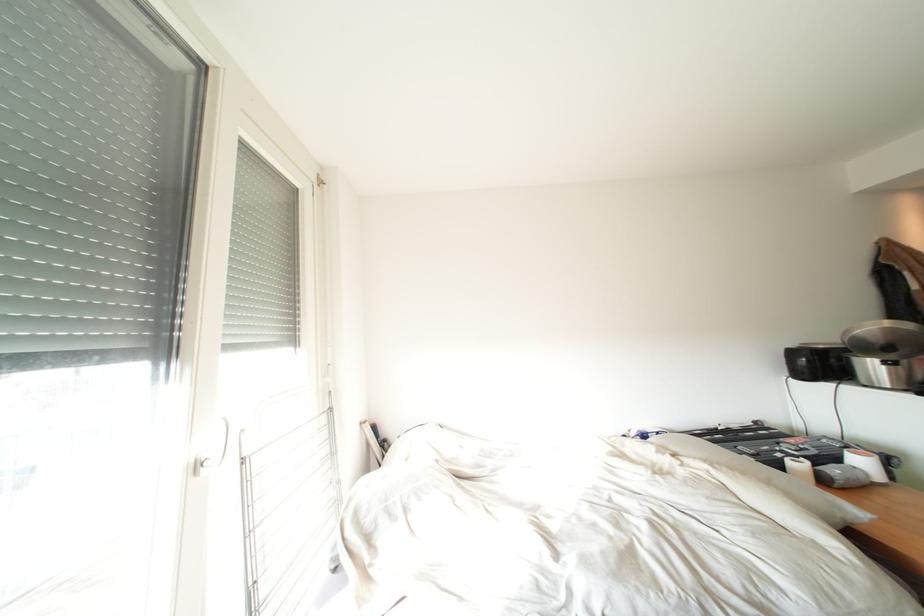
What do you see at coordinates (783, 445) in the screenshot? This screenshot has width=924, height=616. I see `the black suitcase handle` at bounding box center [783, 445].